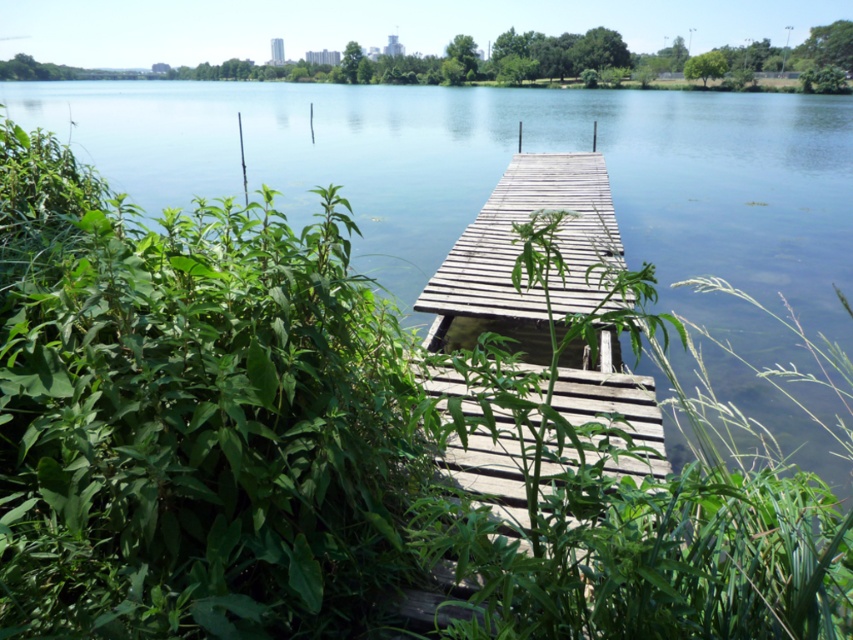
Question: Can you confirm if green leafy plant at center is smaller than green leafy plants at upper center?

Choices:
 (A) yes
 (B) no

Answer: (A)

Question: Which of the following is the closest to the observer?

Choices:
 (A) green leafy plant at center
 (B) green leafy plants at upper center

Answer: (A)

Question: Is green leafy plant at center wider than green leafy plants at upper center?

Choices:
 (A) yes
 (B) no

Answer: (B)

Question: Which point appears farthest from the camera in this image?

Choices:
 (A) (712, 508)
 (B) (254, 22)

Answer: (B)

Question: Is green leafy plant at center wider than green leafy plants at upper center?

Choices:
 (A) no
 (B) yes

Answer: (A)